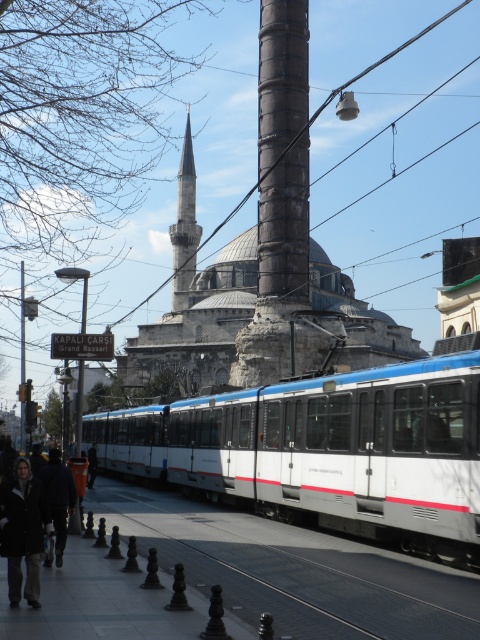
Who is taller, white glossy train at center or smooth stone minaret at center?

With more height is smooth stone minaret at center.

Does white glossy train at center appear on the left side of smooth stone minaret at center?

No, white glossy train at center is not to the left of smooth stone minaret at center.

Between point (348, 532) and point (187, 294), which one is positioned in front?

Point (348, 532) is more forward.

Identify the location of white glossy train at center. The width and height of the screenshot is (480, 640). (324, 451).

Does white glossy train at center have a greater height compared to dark gray jacket at lower left?

Correct, white glossy train at center is much taller as dark gray jacket at lower left.

Is white glossy train at center closer to the viewer compared to dark gray jacket at lower left?

No, it is not.

Who is more distant from viewer, (108, 470) or (68, 474)?

The point (108, 470) is behind.

You are a GUI agent. You are given a task and a screenshot of the screen. Output one action in this format:
    pyautogui.click(x=<x>, y=<y>)
    Task: Click on the white glossy train at center
    The height and width of the screenshot is (640, 480).
    Given the screenshot: What is the action you would take?
    pyautogui.click(x=324, y=451)

Who is higher up, black fur coat at lower left or dark gray jacket at lower left?

black fur coat at lower left is above.

Who is more distant from viewer, (12,544) or (57,538)?

Positioned behind is point (57,538).

Describe the element at coordinates (23, 531) in the screenshot. This screenshot has height=640, width=480. I see `black fur coat at lower left` at that location.

The width and height of the screenshot is (480, 640). Find the location of `black fur coat at lower left`. black fur coat at lower left is located at coordinates (23, 531).